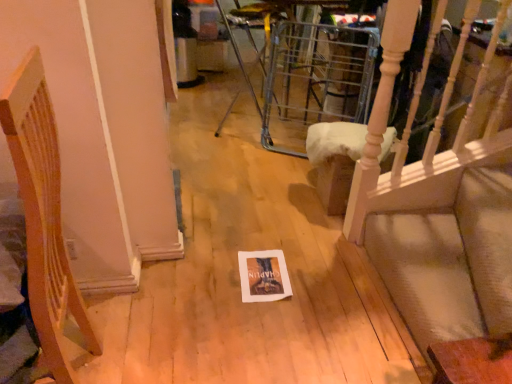
Identify the location of wooden chair at left, which is the second furniture from back to front. (42, 213).

In order to face wooden chair at left, the first furniture positioned from the left, should I rotate leftwards or rightwards?

To face it directly, rotate left by 30.659 degrees.

Describe the element at coordinates (42, 213) in the screenshot. I see `wooden chair at left, the 1th furniture positioned from the front` at that location.

In order to face light wood chair at upper right, which appears as the 1th furniture when viewed from the back, should I rotate leftwards or rightwards?

You should rotate right by 12.458 degrees.

Where is `light wood chair at upper right, which appears as the 1th furniture when viewed from the back`? light wood chair at upper right, which appears as the 1th furniture when viewed from the back is located at coordinates (335, 160).

What do you see at coordinates (335, 160) in the screenshot? This screenshot has width=512, height=384. I see `light wood chair at upper right, which ranks as the second furniture in left-to-right order` at bounding box center [335, 160].

Locate an element on the screen. wooden chair at left, which is the second furniture from back to front is located at coordinates (42, 213).

Is wooden chair at left, the 2th furniture when ordered from right to left, to the left or to the right of light wood chair at upper right, which ranks as the second furniture in left-to-right order, in the image?

wooden chair at left, the 2th furniture when ordered from right to left, is positioned on light wood chair at upper right, which ranks as the second furniture in left-to-right order,'s left side.

Which object is further away from the camera taking this photo, wooden chair at left, the first furniture positioned from the left, or light wood chair at upper right, the second furniture from the front?

light wood chair at upper right, the second furniture from the front, is further from the camera.

Considering the points (36, 79) and (332, 207), which point is behind, point (36, 79) or point (332, 207)?

The point (332, 207) is farther.

From the image's perspective, which is below, wooden chair at left, the 2th furniture when ordered from right to left, or light wood chair at upper right, which ranks as the second furniture in left-to-right order?

wooden chair at left, the 2th furniture when ordered from right to left, appears lower in the image.

From a real-world perspective, who is located higher, wooden chair at left, the first furniture positioned from the left, or light wood chair at upper right, which ranks as the second furniture in left-to-right order?

wooden chair at left, the first furniture positioned from the left, from a real-world perspective.

Which of these two, wooden chair at left, the first furniture positioned from the left, or light wood chair at upper right, which appears as the 1th furniture when viewed from the back, is wider?

With larger width is wooden chair at left, the first furniture positioned from the left.

Based on the photo, who is taller, wooden chair at left, the 2th furniture when ordered from right to left, or light wood chair at upper right, which appears as the 1th furniture when viewed from the back?

With more height is wooden chair at left, the 2th furniture when ordered from right to left.

Between wooden chair at left, which is the second furniture from back to front, and light wood chair at upper right, which appears as the 1th furniture when viewed from the back, which one has larger size?

Bigger between the two is wooden chair at left, which is the second furniture from back to front.

Could light wood chair at upper right, which appears as the 1th furniture when viewed from the back, be considered to be inside wooden chair at left, the first furniture positioned from the left?

No, light wood chair at upper right, which appears as the 1th furniture when viewed from the back, is not inside wooden chair at left, the first furniture positioned from the left.

Is wooden chair at left, the 1th furniture positioned from the front, not close to light wood chair at upper right, the second furniture from the front?

Indeed, wooden chair at left, the 1th furniture positioned from the front, is not near light wood chair at upper right, the second furniture from the front.

Does wooden chair at left, the 2th furniture when ordered from right to left, turn towards light wood chair at upper right, which appears as the 1th furniture when viewed from the back?

No, wooden chair at left, the 2th furniture when ordered from right to left, is not turned towards light wood chair at upper right, which appears as the 1th furniture when viewed from the back.

Can you tell me how much wooden chair at left, the 1th furniture positioned from the front, and light wood chair at upper right, which appears as the 1th furniture when viewed from the back, differ in facing direction?

They differ by 6.06 degrees in their facing directions.

How much distance is there between wooden chair at left, the first furniture positioned from the left, and light wood chair at upper right, which appears as the 1th furniture when viewed from the back?

1.36 meters.

Identify the location of furniture on the right of the wooden chair at left, the first furniture positioned from the left. (335, 160).

Is light wood chair at upper right, which appears as the first furniture when viewed from the right, to the right of wooden chair at left, which is the second furniture from back to front, from the viewer's perspective?

Indeed, light wood chair at upper right, which appears as the first furniture when viewed from the right, is positioned on the right side of wooden chair at left, which is the second furniture from back to front.

Considering the positions of objects light wood chair at upper right, the second furniture from the front, and wooden chair at left, the first furniture positioned from the left, in the image provided, who is behind, light wood chair at upper right, the second furniture from the front, or wooden chair at left, the first furniture positioned from the left,?

light wood chair at upper right, the second furniture from the front, is behind.

Does point (336, 146) come farther from viewer compared to point (29, 120)?

Yes.

From the picture: From the image's perspective, which is below, light wood chair at upper right, which appears as the 1th furniture when viewed from the back, or wooden chair at left, the 1th furniture positioned from the front?

wooden chair at left, the 1th furniture positioned from the front, appears lower in the image.

From a real-world perspective, who is located higher, light wood chair at upper right, which appears as the 1th furniture when viewed from the back, or wooden chair at left, the first furniture positioned from the left?

From a 3D spatial view, wooden chair at left, the first furniture positioned from the left, is above.

Considering the relative sizes of light wood chair at upper right, which appears as the 1th furniture when viewed from the back, and wooden chair at left, the 2th furniture when ordered from right to left, in the image provided, is light wood chair at upper right, which appears as the 1th furniture when viewed from the back, thinner than wooden chair at left, the 2th furniture when ordered from right to left,?

Yes.

Which of these two, light wood chair at upper right, which appears as the first furniture when viewed from the right, or wooden chair at left, which is the second furniture from back to front, stands taller?

Standing taller between the two is wooden chair at left, which is the second furniture from back to front.

Who is smaller, light wood chair at upper right, which appears as the first furniture when viewed from the right, or wooden chair at left, the first furniture positioned from the left?

Smaller between the two is light wood chair at upper right, which appears as the first furniture when viewed from the right.

Is light wood chair at upper right, which ranks as the second furniture in left-to-right order, positioned beyond the bounds of wooden chair at left, which is the second furniture from back to front?

Absolutely, light wood chair at upper right, which ranks as the second furniture in left-to-right order, is external to wooden chair at left, which is the second furniture from back to front.

From the picture: Are light wood chair at upper right, which appears as the 1th furniture when viewed from the back, and wooden chair at left, the 1th furniture positioned from the front, beside each other?

No, light wood chair at upper right, which appears as the 1th furniture when viewed from the back, is not touching wooden chair at left, the 1th furniture positioned from the front.

Is wooden chair at left, the 1th furniture positioned from the front, at the back of light wood chair at upper right, the second furniture from the front?

No, light wood chair at upper right, the second furniture from the front, is not facing away from wooden chair at left, the 1th furniture positioned from the front.

Looking at this image, how many degrees apart are the facing directions of light wood chair at upper right, the second furniture from the front, and wooden chair at left, the 2th furniture when ordered from right to left?

There is a 6.06-degree angle between the facing directions of light wood chair at upper right, the second furniture from the front, and wooden chair at left, the 2th furniture when ordered from right to left.

There is a light wood chair at upper right, which ranks as the second furniture in left-to-right order. At what (x,y) coordinates should I click in order to perform the action: click on furniture above it (from a real-world perspective). Please return your answer as a coordinate pair (x, y). Looking at the image, I should click on click(42, 213).

This screenshot has width=512, height=384. I want to click on furniture directly beneath the wooden chair at left, the 2th furniture when ordered from right to left (from a real-world perspective), so click(x=335, y=160).

Where is `furniture above the wooden chair at left, the 1th furniture positioned from the front (from the image's perspective)`? This screenshot has height=384, width=512. furniture above the wooden chair at left, the 1th furniture positioned from the front (from the image's perspective) is located at coordinates (335, 160).